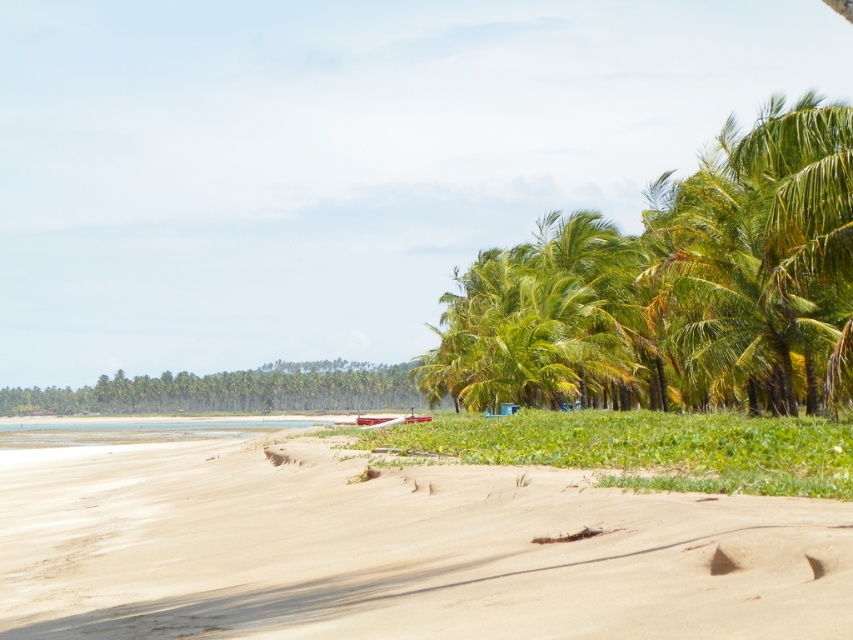
What are the coordinates of `sandy beach at lower left` in the screenshot? It's located at (396, 548).

Can you confirm if sandy beach at lower left is positioned above green leafy coconut trees at right?

Actually, sandy beach at lower left is below green leafy coconut trees at right.

Between point (184, 547) and point (523, 376), which one is positioned in front?

Positioned in front is point (184, 547).

Locate an element on the screen. sandy beach at lower left is located at coordinates (396, 548).